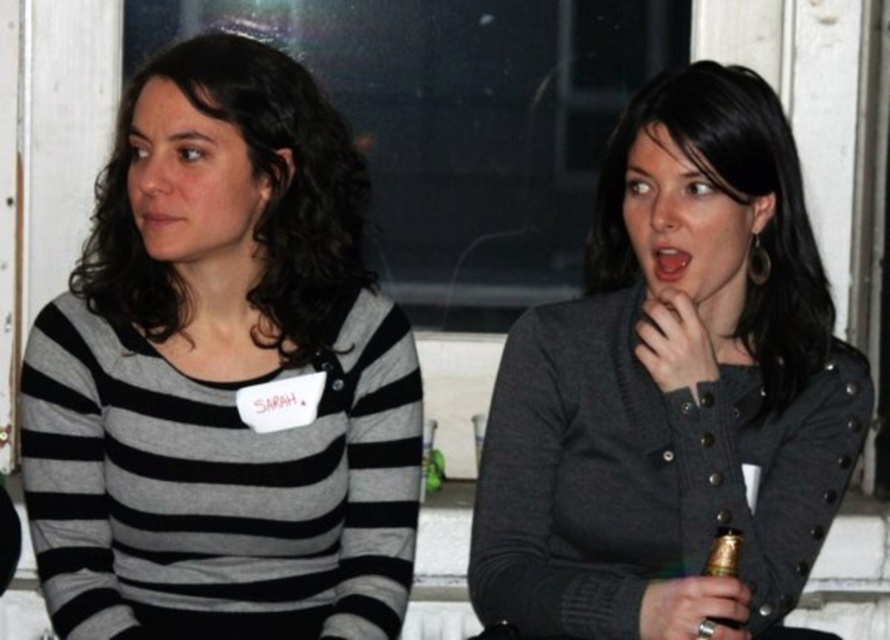
Does point (340, 625) lie behind point (479, 513)?

No, it is in front of (479, 513).

Between point (63, 438) and point (721, 294), which one is positioned in front?

Point (63, 438) is more forward.

The width and height of the screenshot is (890, 640). Identify the location of striped cotton shirt at left. (222, 376).

The width and height of the screenshot is (890, 640). I want to click on striped cotton shirt at left, so click(x=222, y=376).